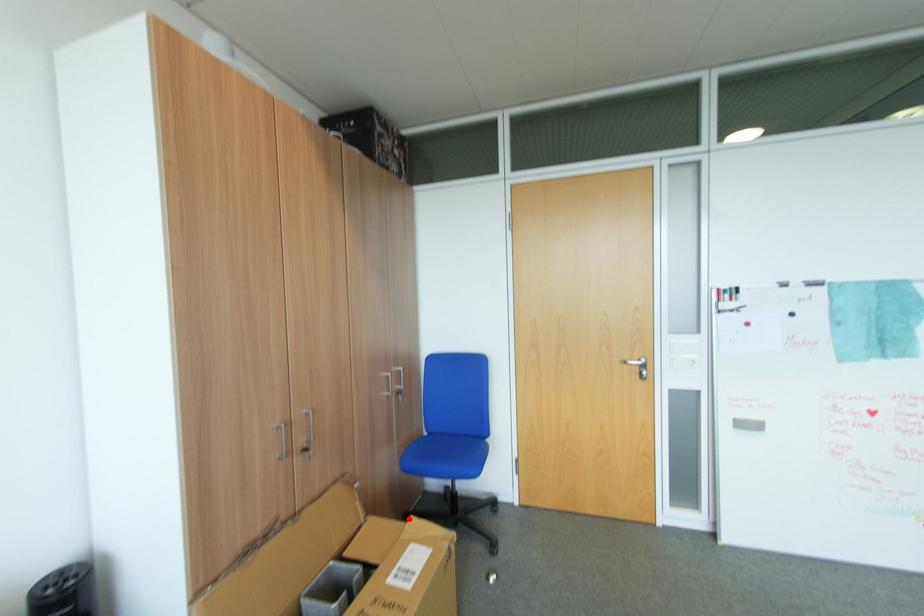
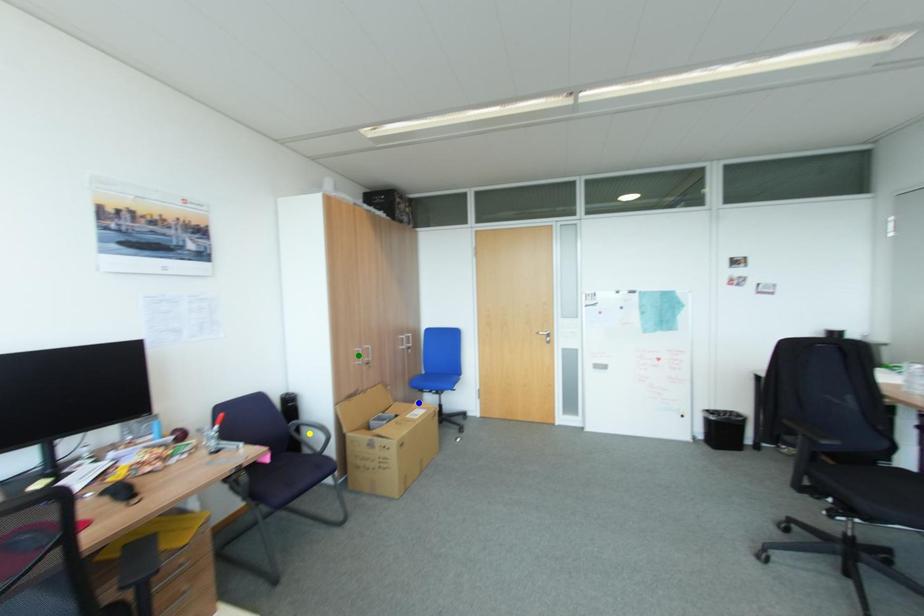
Question: I am providing you with two images of the same scene from different viewpoints. A red point is marked on the first image. You are given multiple points on the second image. Which point in image 2 represents the same 3d spot as the red point in image 1?

Choices:
 (A) green point
 (B) yellow point
 (C) blue point

Answer: (C)